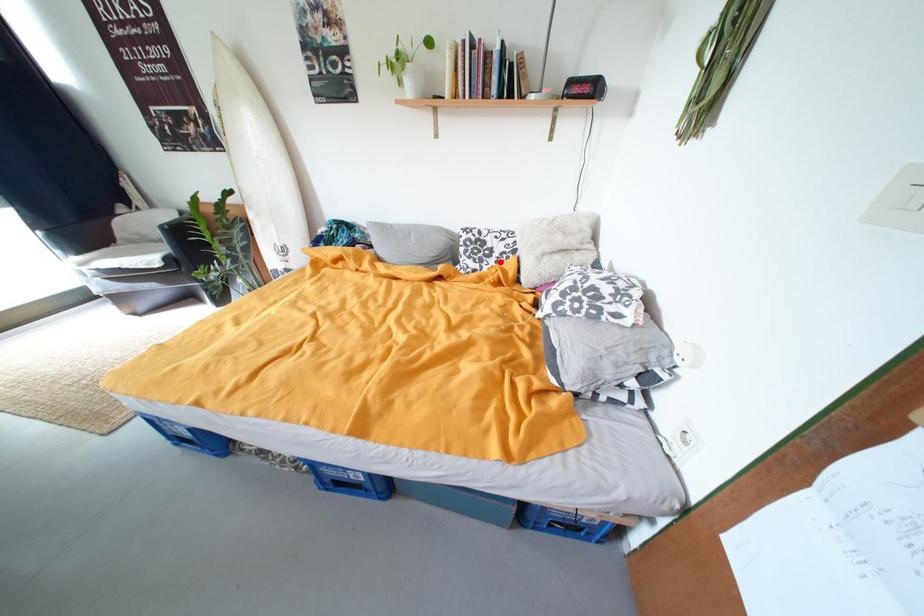
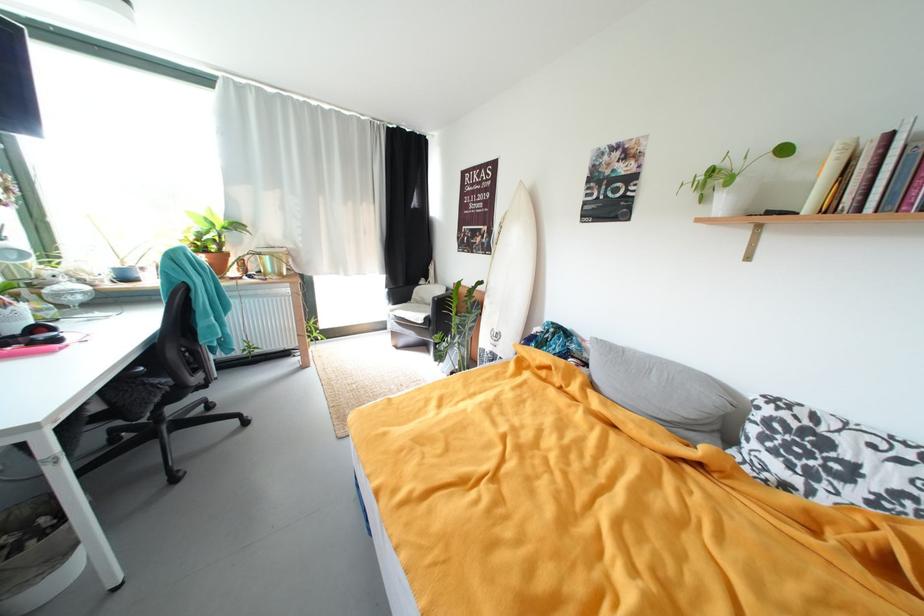
Locate, in the second image, the point that corresponds to the highlighted location in the first image.

(861, 493)